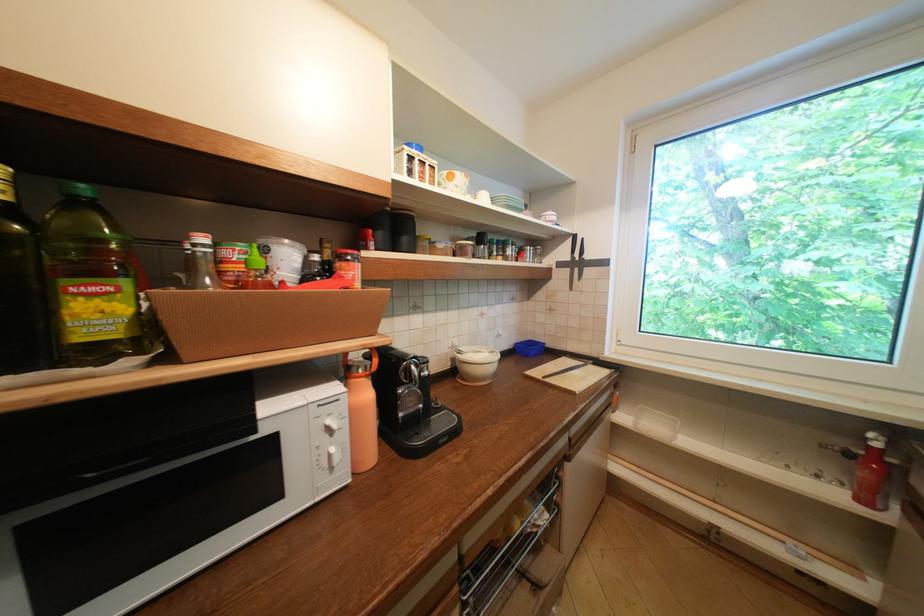
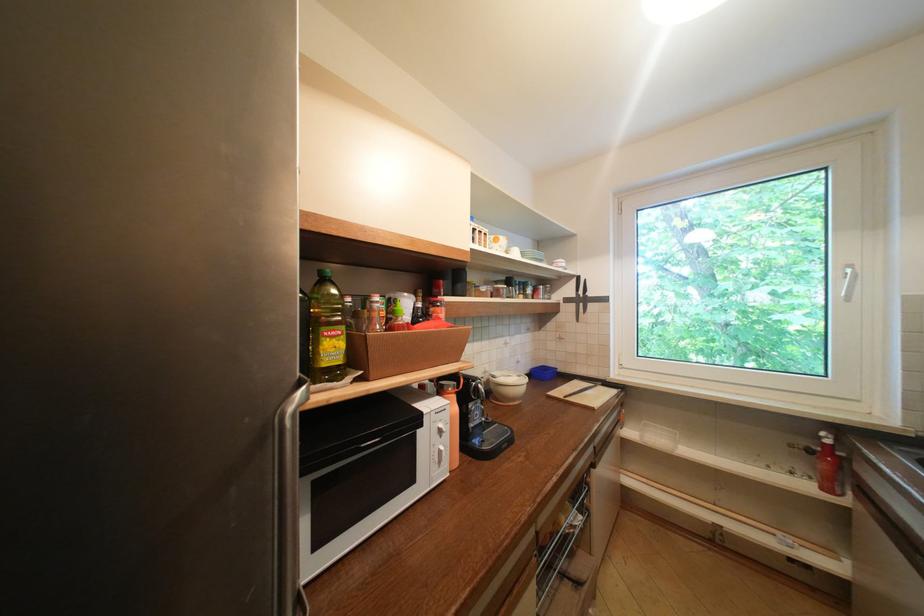
In the second image, find the point that corresponds to the point at 539,374 in the first image.

(561, 394)